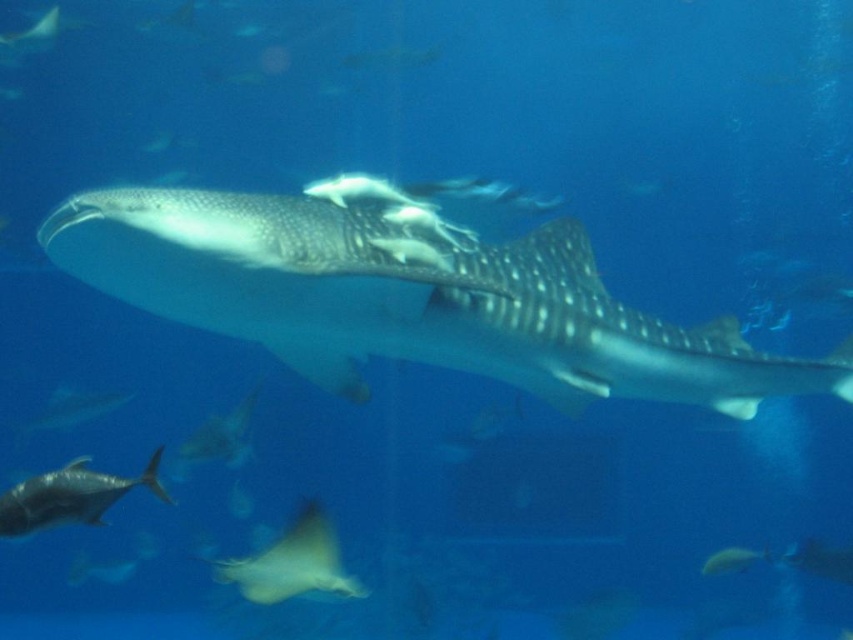
Question: Is shiny silver fish at lower left bigger than silvery metallic fish at lower left?

Choices:
 (A) yes
 (B) no

Answer: (B)

Question: Is smooth gray shark at center to the right of silvery metallic fish at lower left from the viewer's perspective?

Choices:
 (A) yes
 (B) no

Answer: (A)

Question: Which point appears closest to the camera in this image?

Choices:
 (A) (94, 499)
 (B) (315, 499)

Answer: (A)

Question: Which object appears closest to the camera in this image?

Choices:
 (A) silvery metallic fish at lower left
 (B) smooth gray shark at center

Answer: (B)

Question: Can you confirm if translucent yellow ray at lower center is positioned to the left of shiny silver fish at lower left?

Choices:
 (A) no
 (B) yes

Answer: (A)

Question: Which point is closer to the camera?

Choices:
 (A) shiny silver fish at center
 (B) silvery metallic fish at lower left

Answer: (A)